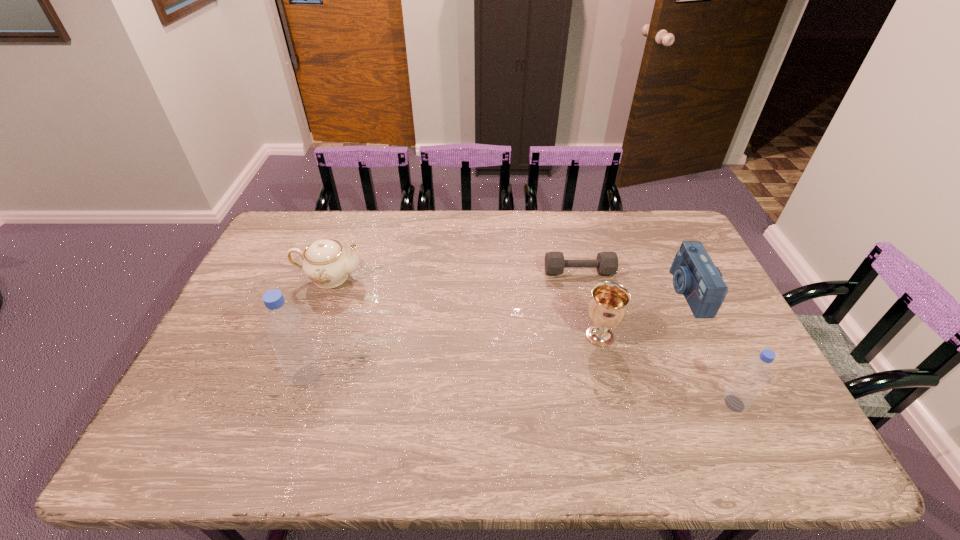
What are the coordinates of `free spot that satisfies the following two spatial constraints: 1. at the spout of the chinaware; 2. on the left side of the left bottle` in the screenshot? It's located at (294, 376).

Find the location of a particular element. The image size is (960, 540). free space in the image that satisfies the following two spatial constraints: 1. at the spout of the tallest object; 2. on the left side of the chinaware is located at coordinates (294, 376).